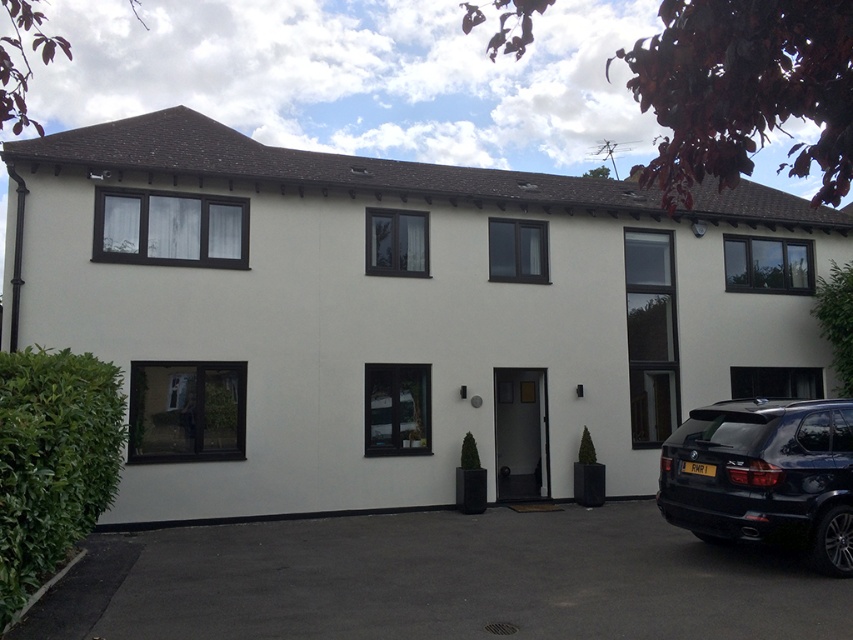
You are standing in front of the two story residential building and notice a black glossy suv at lower right and a green leafy bush at lower left. Which object is closer to the ground?

The black glossy suv at lower right is closer to the ground because it is below the green leafy bush at lower left.

You are standing in front of the residential building and want to park your car in the driveway. Where should you position your car relative to the black glossy suv at lower right?

The black glossy suv at lower right is located at point [764,476], so you should park your car in the driveway near that coordinate to align with the existing vehicle.